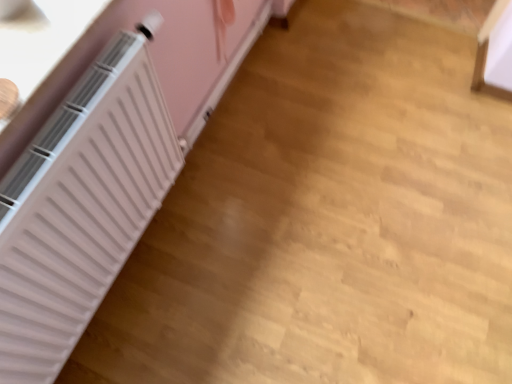
I want to click on unoccupied area in front of white matte radiator at left, so click(x=223, y=279).